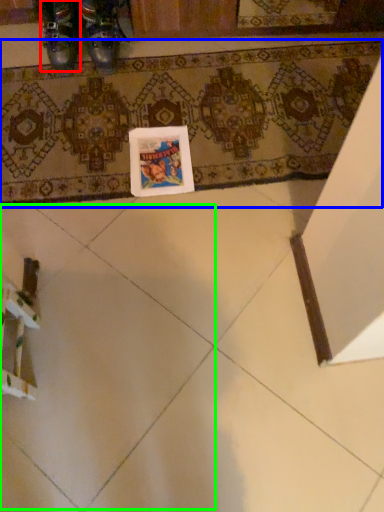
Question: Considering the real-world distances, which object is closest to footwear (highlighted by a red box)? bath mat (highlighted by a blue box) or ceramic tile (highlighted by a green box).

Choices:
 (A) bath mat
 (B) ceramic tile

Answer: (A)